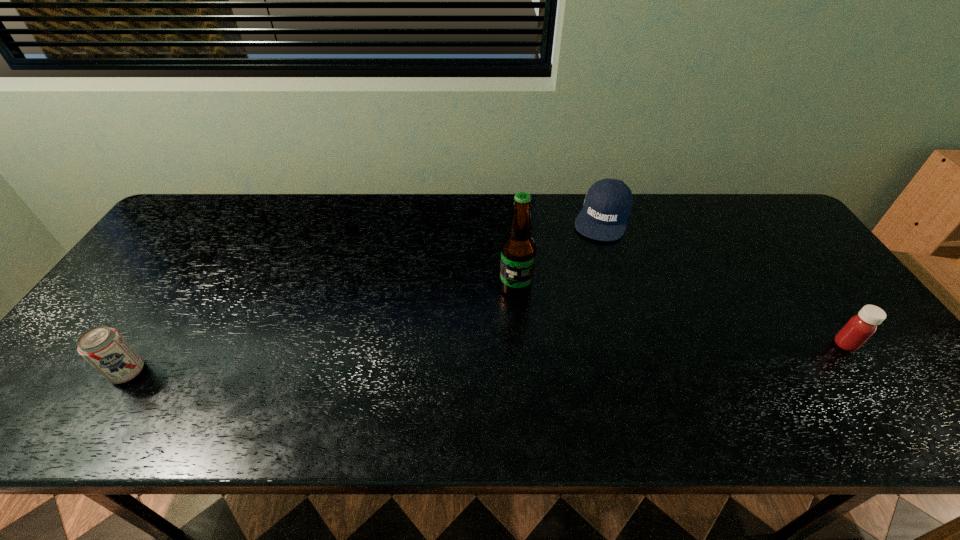
Identify the location of free spot on the desktop that is between the leftmost object and the second nearest object and is positioned on the label of the beer bottle. coord(451,360).

This screenshot has width=960, height=540. In order to click on free space on the desktop that is between the nearest object and the medicine and is positioned on the front-facing side of the farthest object in this screenshot , I will do `click(547, 356)`.